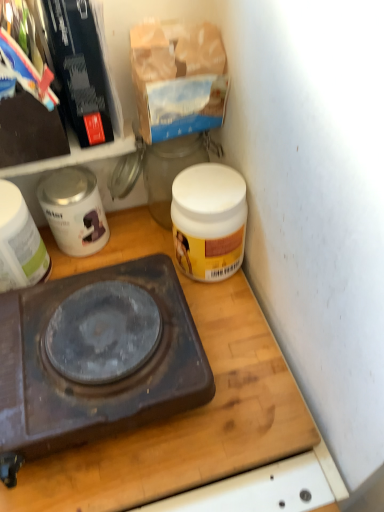
In order to click on vacant area on top of dark brown plastic gas stove at center (from a real-world perspective) in this screenshot , I will do `click(86, 343)`.